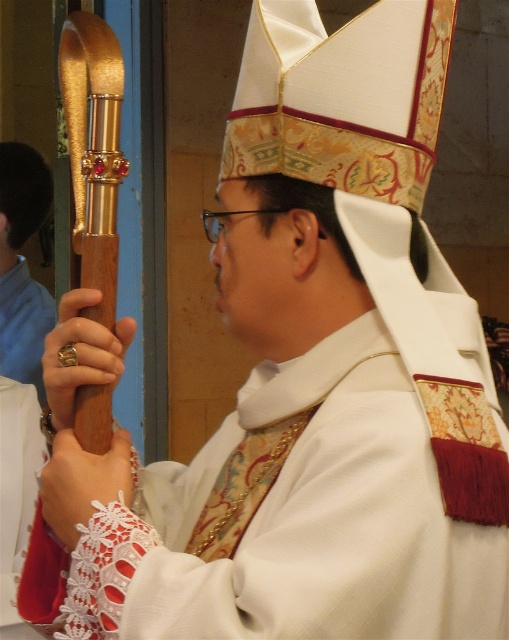
Question: Which of the following is the closest to the observer?

Choices:
 (A) gold metallic ring at lower left
 (B) gold polished staff at upper left

Answer: (A)

Question: Which object is the closest to the gold metallic ring at lower left?

Choices:
 (A) white lace at lower left
 (B) gold polished staff at upper left

Answer: (A)

Question: Does gold metallic ring at lower left appear on the left side of white lace at lower left?

Choices:
 (A) yes
 (B) no

Answer: (A)

Question: Does gold metallic ring at lower left appear over white lace at lower left?

Choices:
 (A) yes
 (B) no

Answer: (A)

Question: Can you confirm if gold polished staff at upper left is positioned above white lace at lower left?

Choices:
 (A) no
 (B) yes

Answer: (B)

Question: Estimate the real-world distances between objects in this image. Which object is farther from the white lace at lower left?

Choices:
 (A) gold polished staff at upper left
 (B) gold metallic ring at lower left

Answer: (A)